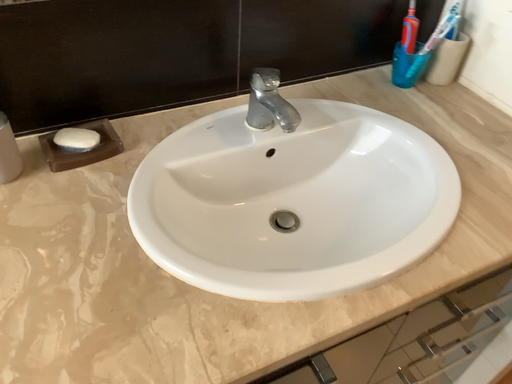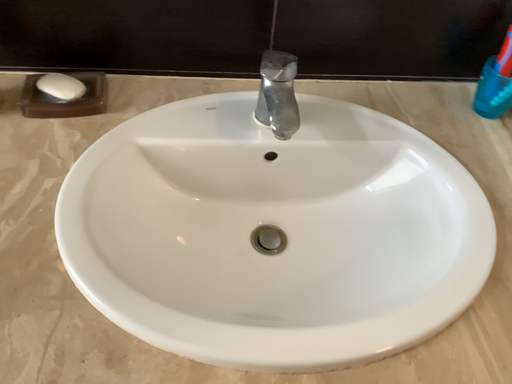
Question: Which way did the camera rotate in the video?

Choices:
 (A) rotated left
 (B) rotated right

Answer: (A)